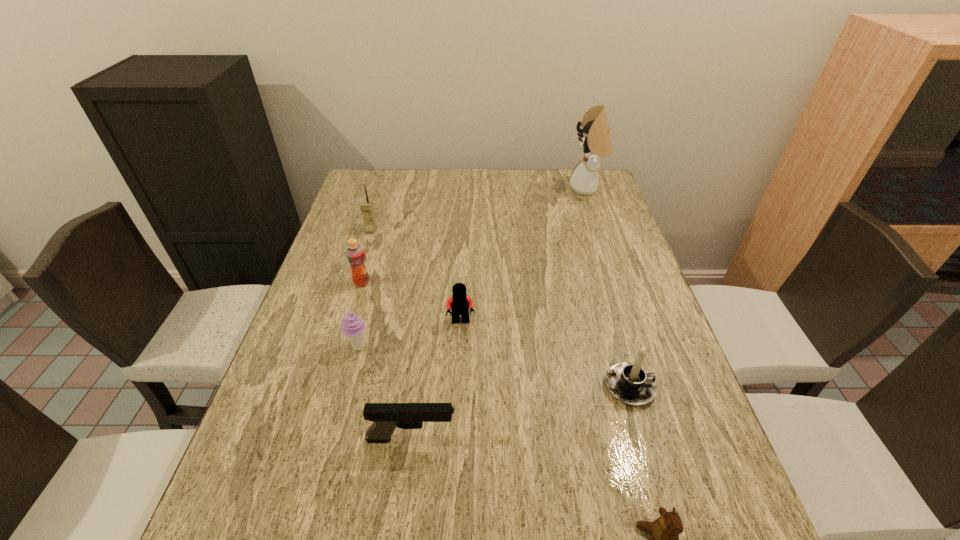
This screenshot has width=960, height=540. What are the coordinates of `icecream that is at the left edge` in the screenshot? It's located at (353, 327).

What are the coordinates of `doll positioned at the right edge` in the screenshot? It's located at (595, 140).

Where is `candle holder at the right edge`? candle holder at the right edge is located at coordinates (630, 383).

Where is `object located at the far right corner`? object located at the far right corner is located at coordinates (595, 140).

Where is `vacant area at the far edge`? Image resolution: width=960 pixels, height=540 pixels. vacant area at the far edge is located at coordinates (524, 190).

The height and width of the screenshot is (540, 960). In order to click on vacant space at the left edge of the desktop in this screenshot , I will do `click(375, 256)`.

Locate an element on the screen. vacant space at the right edge of the desktop is located at coordinates (646, 339).

This screenshot has width=960, height=540. I want to click on free location at the far left corner of the desktop, so pyautogui.click(x=372, y=177).

Locate an element on the screen. blank space at the near left corner of the desktop is located at coordinates (223, 534).

Locate an element on the screen. Image resolution: width=960 pixels, height=540 pixels. vacant area at the far right corner is located at coordinates (556, 174).